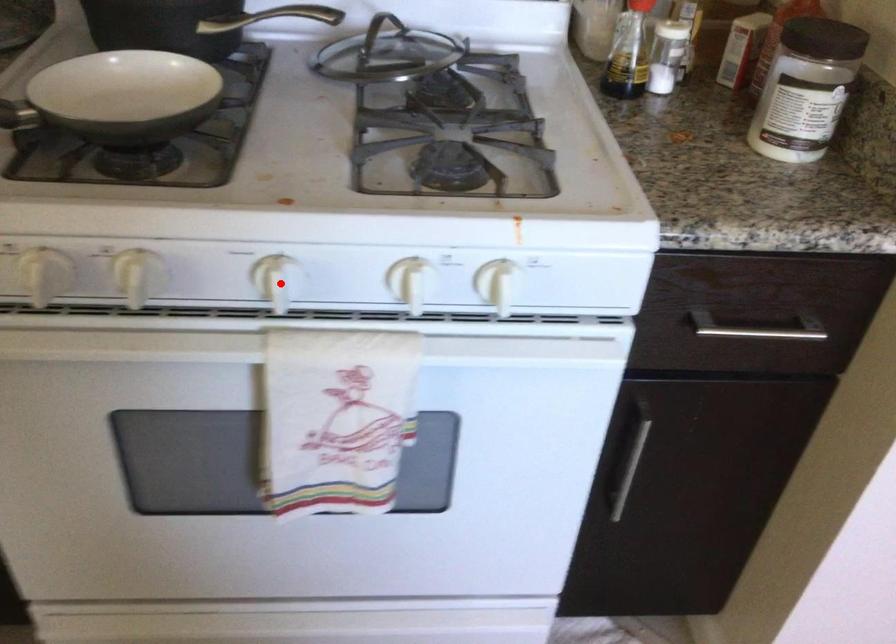
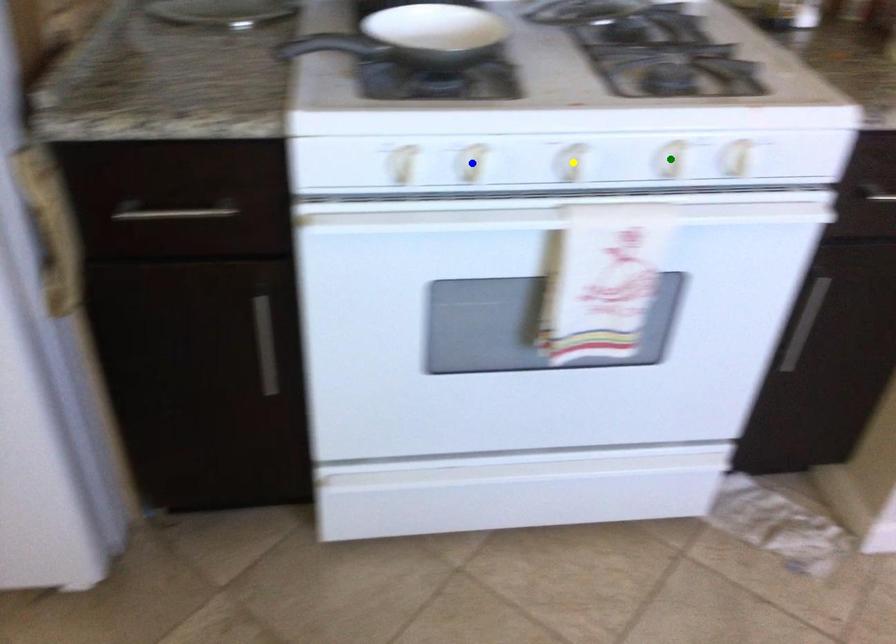
Question: I am providing you with two images of the same scene from different viewpoints. A red point is marked on the first image. You are given multiple points on the second image. Which point in image 2 represents the same 3d spot as the red point in image 1?

Choices:
 (A) green point
 (B) blue point
 (C) yellow point

Answer: (C)